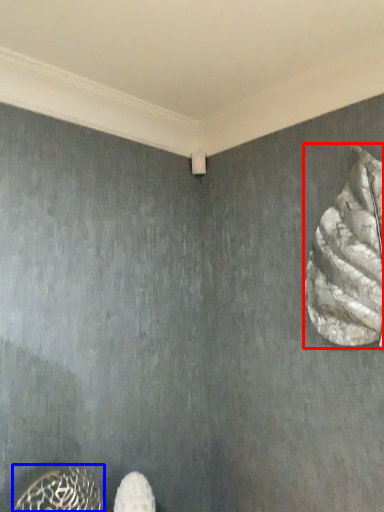
Question: Which point is further to the camera, animal (highlighted by a red box) or animal (highlighted by a blue box)?

Choices:
 (A) animal
 (B) animal

Answer: (A)